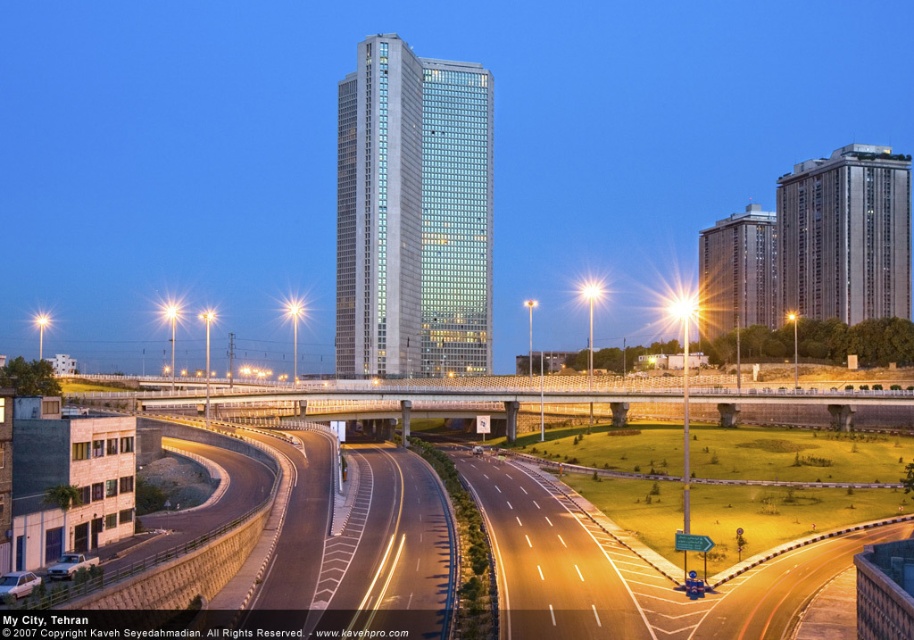
Does glassy concrete skyscraper at center appear under sleek silver building at upper right?

Correct, glassy concrete skyscraper at center is located below sleek silver building at upper right.

This screenshot has height=640, width=914. I want to click on glassy concrete skyscraper at center, so click(x=413, y=214).

Image resolution: width=914 pixels, height=640 pixels. I want to click on glassy concrete skyscraper at center, so click(x=413, y=214).